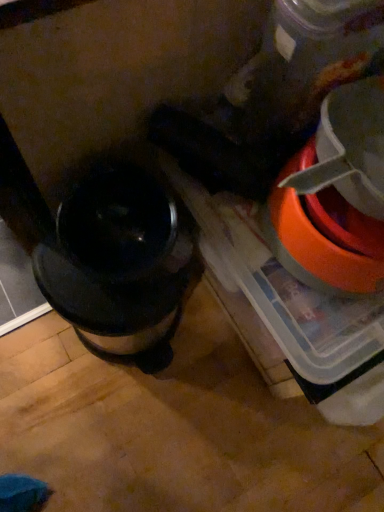
The width and height of the screenshot is (384, 512). I want to click on vacant space in front of shiny metallic coffee maker at left, so click(106, 430).